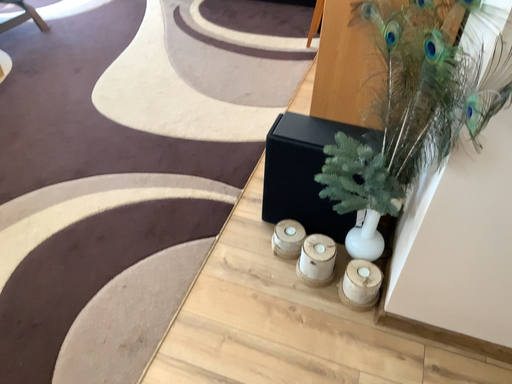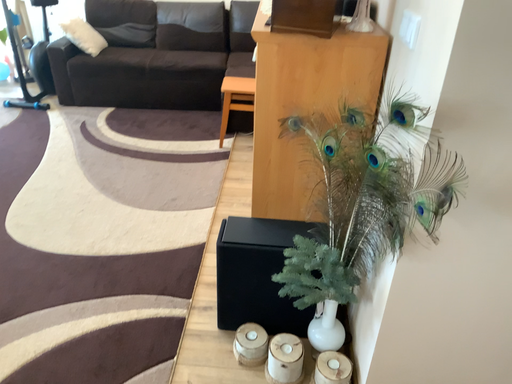
Question: How did the camera likely rotate when shooting the video?

Choices:
 (A) rotated right
 (B) rotated left

Answer: (A)